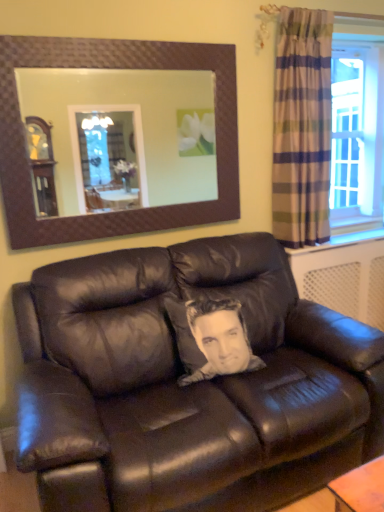
Question: Is plaid fabric curtain at right bigger or smaller than matte black leather couch at center?

Choices:
 (A) big
 (B) small

Answer: (B)

Question: Is plaid fabric curtain at right wider or thinner than matte black leather couch at center?

Choices:
 (A) wide
 (B) thin

Answer: (B)

Question: Which object is positioned closest to the plaid fabric curtain at right?

Choices:
 (A) brown textured mirror at upper center
 (B) matte black leather couch at center

Answer: (B)

Question: Based on their relative distances, which object is nearer to the matte black leather couch at center?

Choices:
 (A) brown textured mirror at upper center
 (B) plaid fabric curtain at right

Answer: (B)